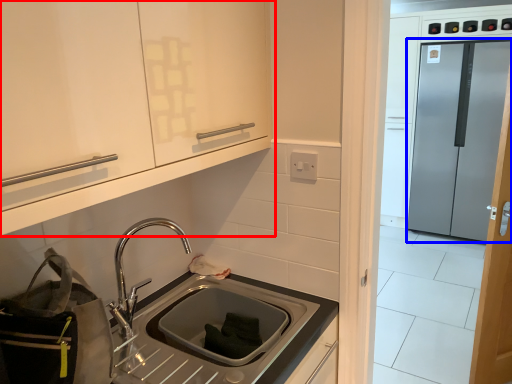
Question: Which point is closer to the camera, cabinetry (highlighted by a red box) or glass door (highlighted by a blue box)?

Choices:
 (A) cabinetry
 (B) glass door

Answer: (A)